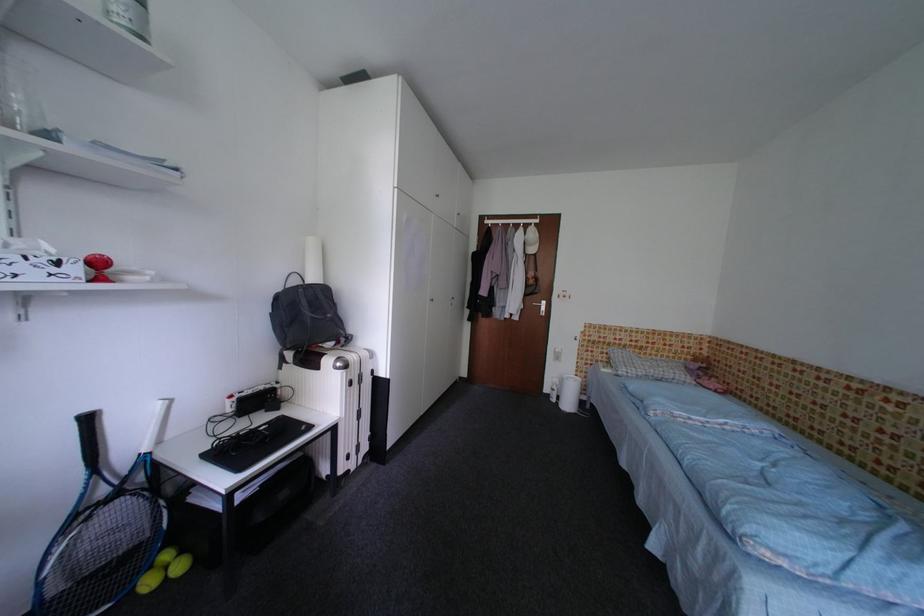
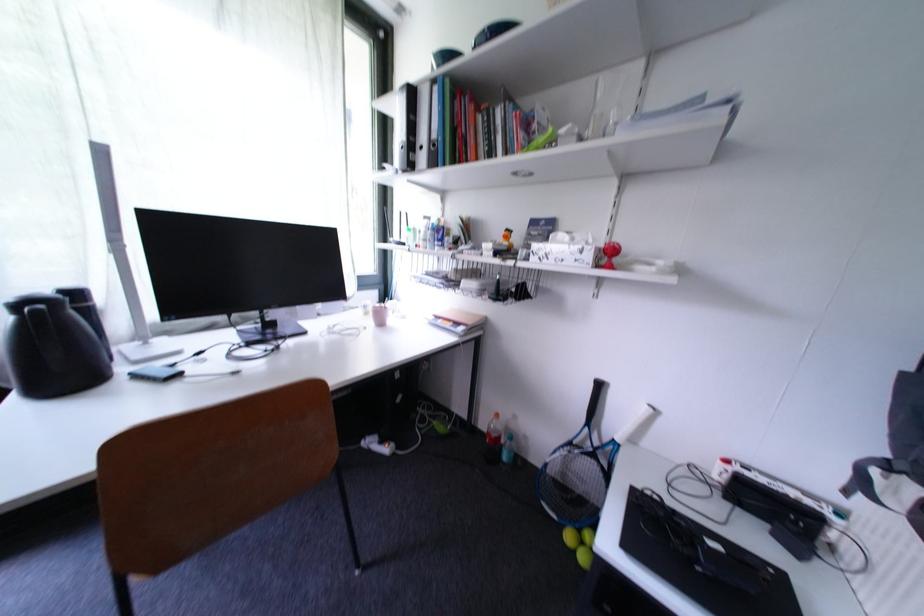
Question: The camera is either moving clockwise (left) or counter-clockwise (right) around the object. The first image is from the beginning of the video and the second image is from the end. Is the camera moving left or right when shooting the video?

Choices:
 (A) Left
 (B) Right

Answer: (B)